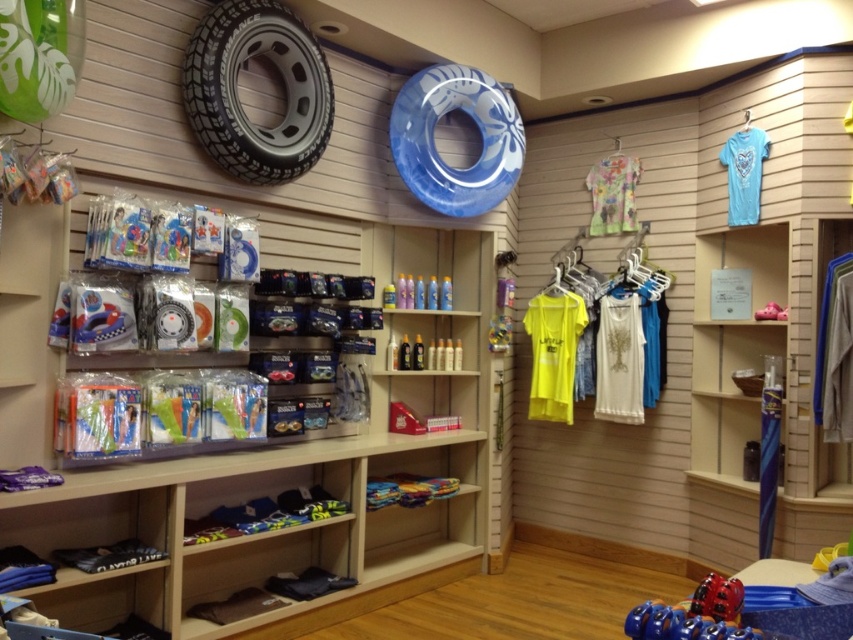
Question: Where is black rubber tire at upper center located in relation to clear plastic bottles at center in the image?

Choices:
 (A) right
 (B) left

Answer: (B)

Question: Is blue plastic roller at lower right to the right of glossy plastic bottles at center from the viewer's perspective?

Choices:
 (A) yes
 (B) no

Answer: (A)

Question: Which point is farther from the camera taking this photo?

Choices:
 (A) (749, 120)
 (B) (718, 592)
 (C) (415, 300)

Answer: (C)

Question: Estimate the real-world distances between objects in this image. Which object is farther from the wooden shelf at center?

Choices:
 (A) gray fabric at center
 (B) glossy plastic bottles at center
 (C) blue plastic roller at lower right

Answer: (C)

Question: Which of the following is the closest to the observer?

Choices:
 (A) (213, 54)
 (B) (402, 326)

Answer: (A)

Question: Is clear plastic bottles at center smaller than floral cotton t-shirt at center?

Choices:
 (A) yes
 (B) no

Answer: (B)